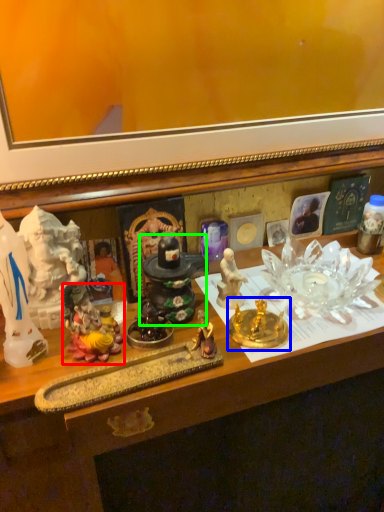
Question: Which is nearer to the toy (highlighted by a red box)? candle holder (highlighted by a blue box) or toy (highlighted by a green box).

Choices:
 (A) candle holder
 (B) toy

Answer: (B)